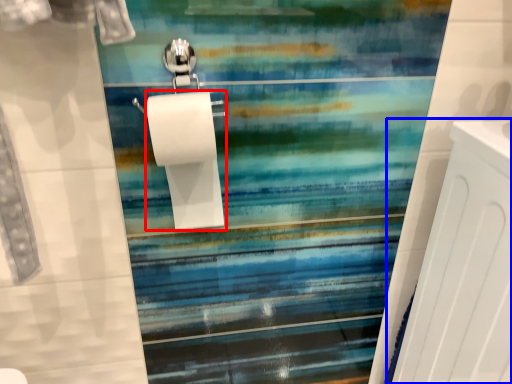
Question: Which of the following is the farthest to the observer, toilet paper (highlighted by a red box) or radiator (highlighted by a blue box)?

Choices:
 (A) toilet paper
 (B) radiator

Answer: (A)